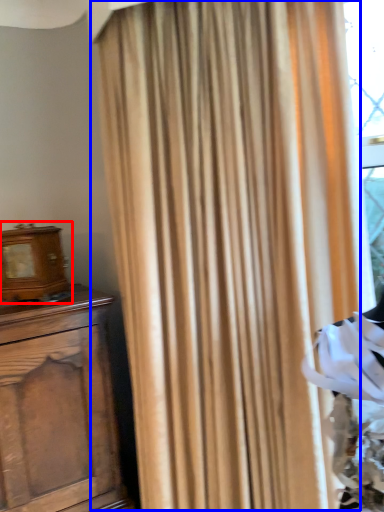
Question: Among these objects, which one is farthest to the camera, alarm clock (highlighted by a red box) or curtain (highlighted by a blue box)?

Choices:
 (A) alarm clock
 (B) curtain

Answer: (A)